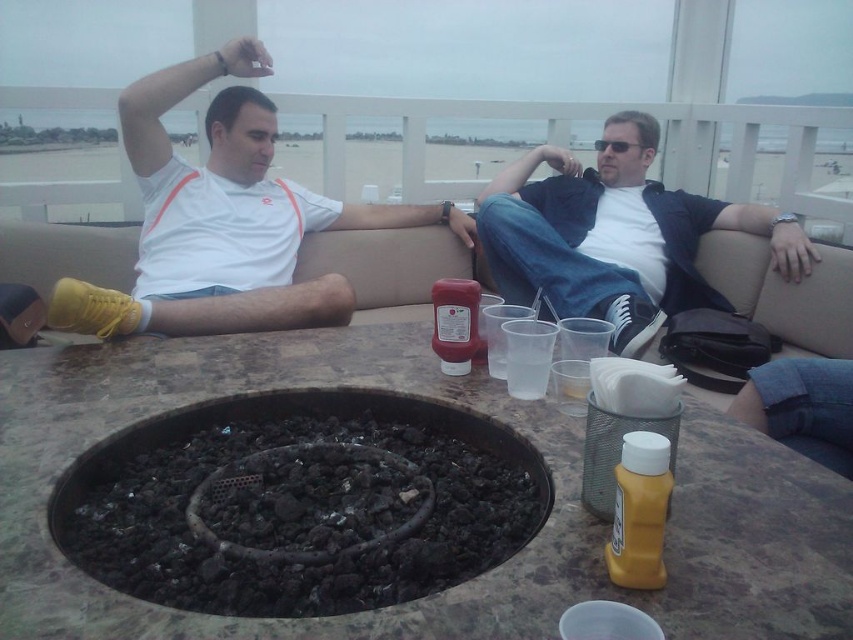
Question: In this image, where is marble table at center located relative to matte black jacket at center?

Choices:
 (A) below
 (B) above

Answer: (A)

Question: Can you confirm if white matte shirt at upper left is smaller than matte black jacket at center?

Choices:
 (A) yes
 (B) no

Answer: (B)

Question: From the image, what is the correct spatial relationship of marble table at center in relation to charcoal ash fire pit at center?

Choices:
 (A) above
 (B) below

Answer: (A)

Question: Which point is farther to the camera?

Choices:
 (A) charcoal ash fire pit at center
 (B) marble table at center

Answer: (A)

Question: Among these objects, which one is nearest to the camera?

Choices:
 (A) matte black jacket at center
 (B) charcoal ash fire pit at center
 (C) white matte shirt at upper left

Answer: (B)

Question: Which point appears closest to the camera in this image?

Choices:
 (A) (637, 113)
 (B) (293, 296)

Answer: (B)